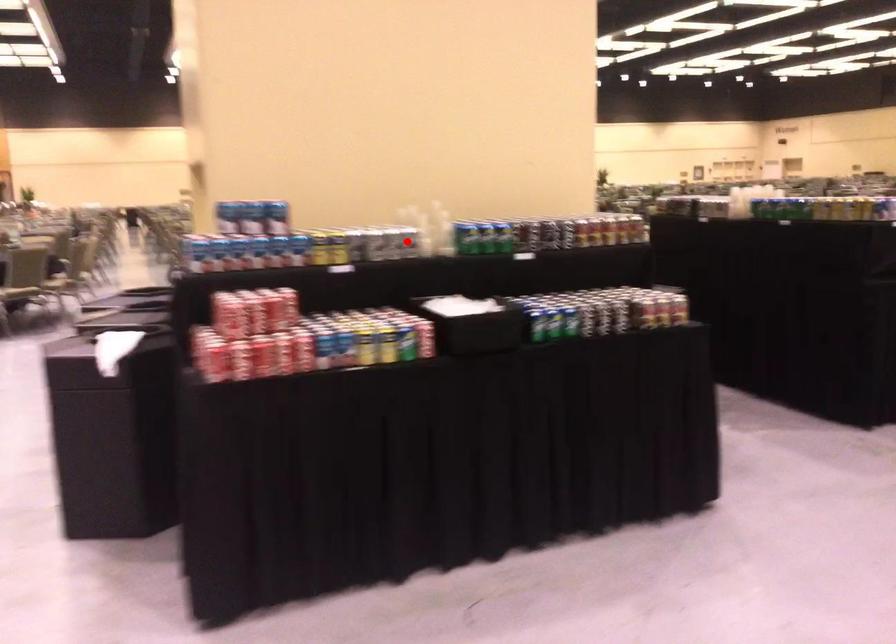
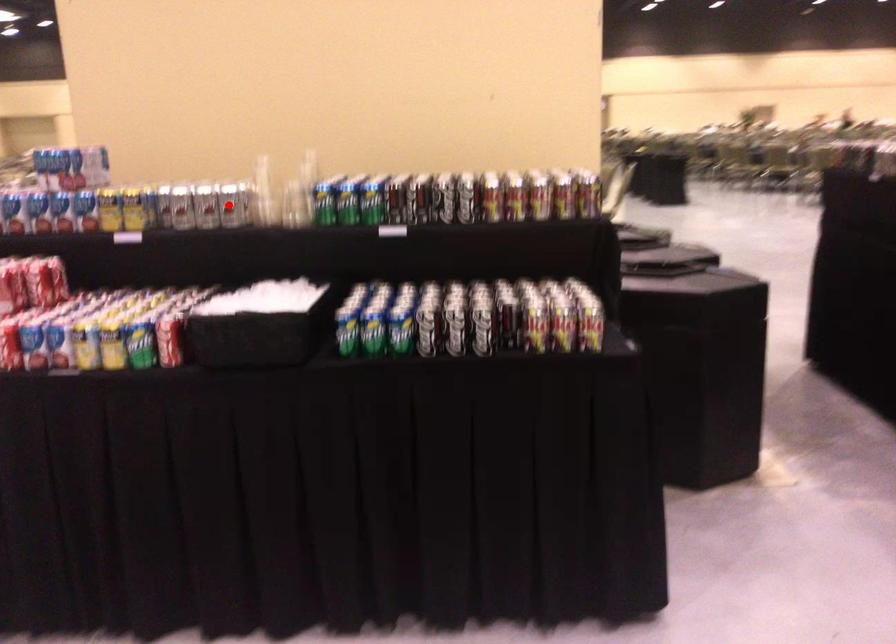
I am providing you with two images of the same scene from different viewpoints. A red point is marked on the first image and another point is marked on the second image. Is the red point in image1 aligned with the point shown in image2?

Yes